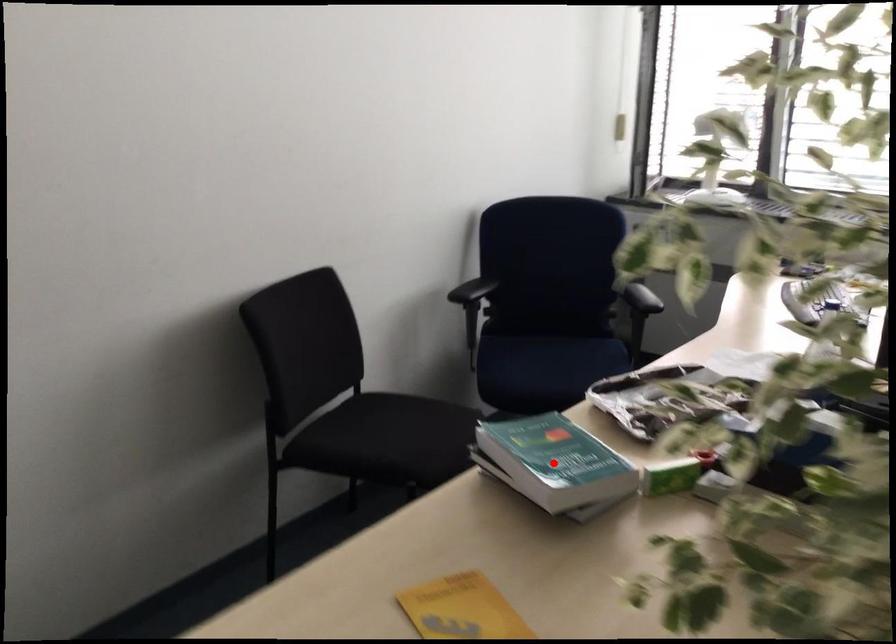
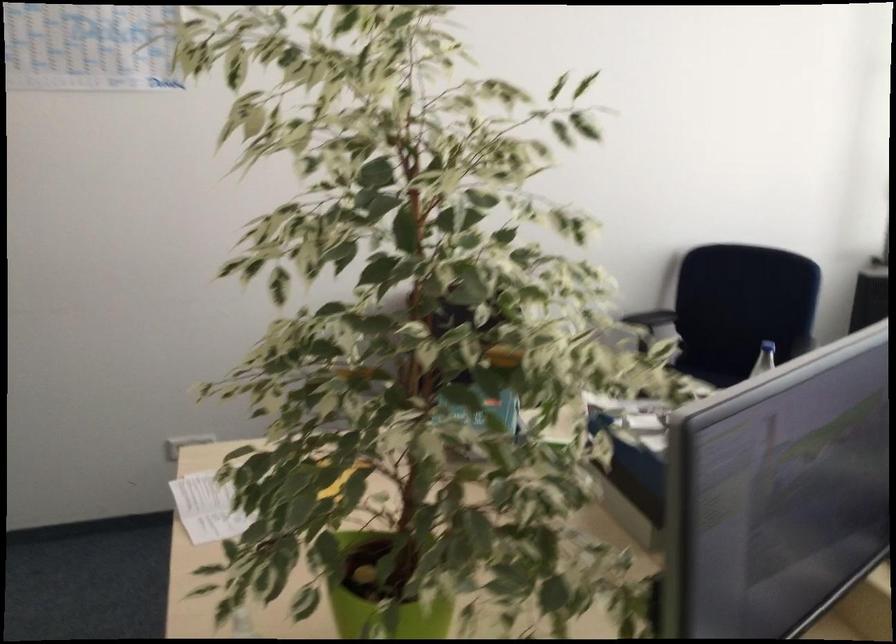
Question: I am providing you with two images of the same scene from different viewpoints. A red point is marked on the first image. At the location where the point appears in image 1, is it still visible in image 2?

Choices:
 (A) Yes
 (B) No

Answer: (B)